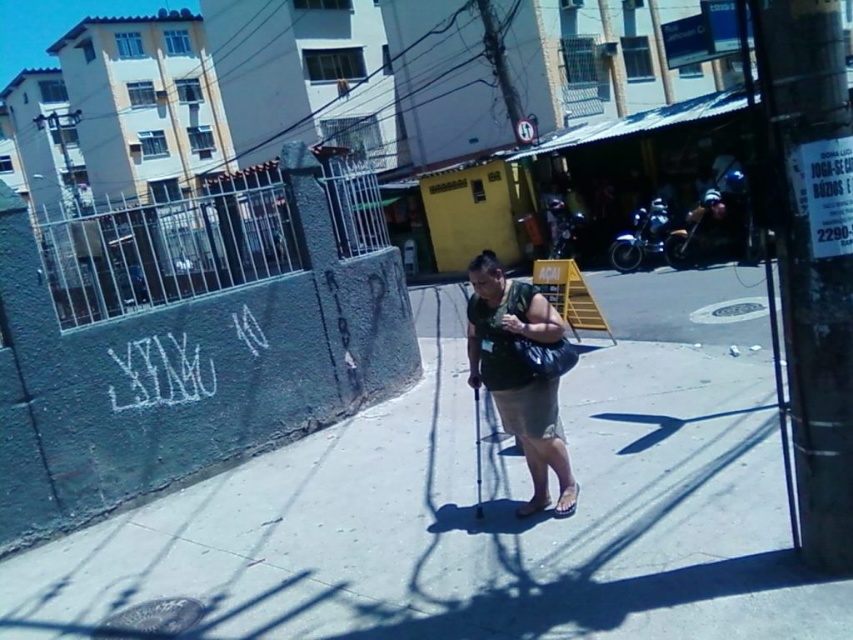
You are a delivery robot that needs to move from the gray concrete pavement at center to the brown leather sandal at center. Can you do so without any obstacles?

The gray concrete pavement at center is higher than the brown leather sandal at center, so the robot can move from the gray concrete pavement at center to the brown leather sandal at center as there is no mention of obstacles in the scene description.

You are a delivery person trying to deliver a package to the address located behind the metallic silver gate at upper left. However, you notice a brown leather sandal at lower right blocking your path. Can you walk around the sandal to reach the gate?

The metallic silver gate at upper left is further to the viewer than the brown leather sandal at lower right, so the sandal is closer to you. You can walk around the brown leather sandal at lower right to reach the gate since it is blocking your path but is closer and movable.

You are a delivery robot with a 1.8 meter long package. You need to move from the metallic silver gate at upper left to the brown leather sandal at lower right. Can you fit the package between them?

The metallic silver gate at upper left and brown leather sandal at lower right are 2.12 meters apart. Since the package is 1.8 meters long, it can fit between them as the distance is sufficient.